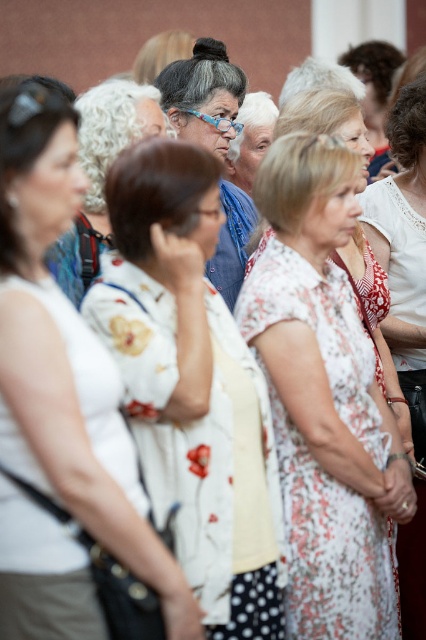
You are a photographer trying to capture a closeup of the floral fabric dress at center and the matte blue glasses at center. Since the background is slightly blurred, which object should you focus on to ensure both are in focus?

The floral fabric dress at center is larger in size than the matte blue glasses at center, so focusing on the larger object will help ensure both are in focus.

You are a photographer trying to capture a closeup shot of the floral fabric dress at center and the matte blue glasses at center. Since you want to focus on the details of both items, which one should you zoom in on more to ensure they both fit in the frame?

The floral fabric dress at center is wider than the matte blue glasses at center, so you should zoom in more on the floral fabric dress at center to ensure both items fit in the frame.